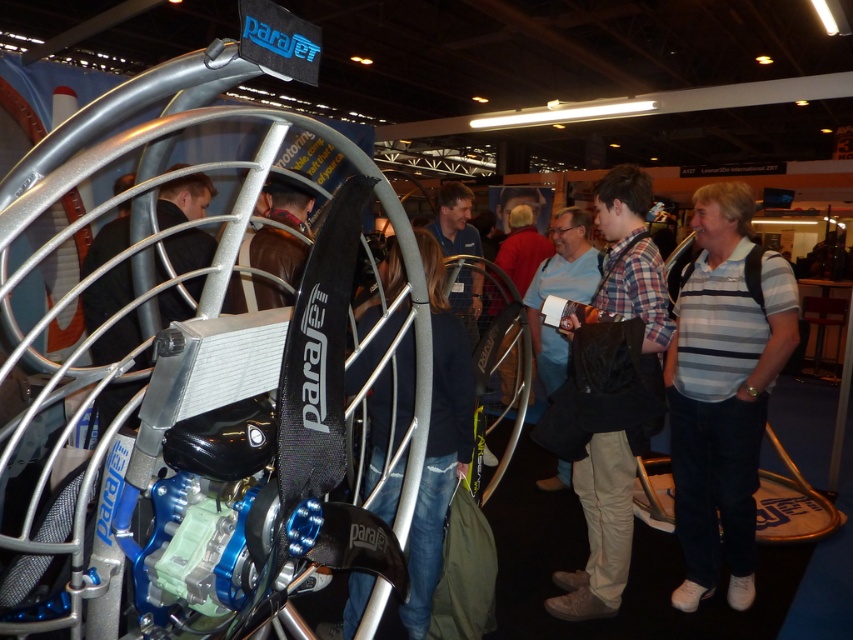
Which is more to the left, plaid fabric shirt at center or dark blue denim jeans at center?

dark blue denim jeans at center

Is plaid fabric shirt at center bigger than dark blue denim jeans at center?

Yes, plaid fabric shirt at center is bigger than dark blue denim jeans at center.

Locate an element on the screen. This screenshot has width=853, height=640. plaid fabric shirt at center is located at coordinates (611, 394).

Is point (733, 259) positioned before point (584, 376)?

No, it is not.

Is white striped shirt at right above plaid fabric shirt at center?

No.

The image size is (853, 640). I want to click on white striped shirt at right, so click(723, 388).

Can you confirm if white striped shirt at right is positioned to the left of dark blue denim jeans at center?

No, white striped shirt at right is not to the left of dark blue denim jeans at center.

Consider the image. Does white striped shirt at right appear on the right side of dark blue denim jeans at center?

Indeed, white striped shirt at right is positioned on the right side of dark blue denim jeans at center.

Does point (737, 595) lie in front of point (422, 493)?

No, (737, 595) is further to viewer.

Where is `white striped shirt at right`? The width and height of the screenshot is (853, 640). white striped shirt at right is located at coordinates (723, 388).